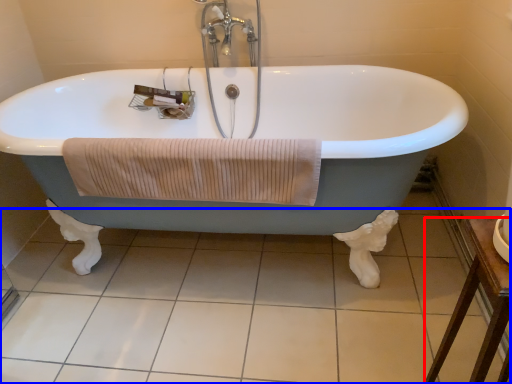
Question: Which object is closer to the camera taking this photo, furniture (highlighted by a red box) or tile (highlighted by a blue box)?

Choices:
 (A) furniture
 (B) tile

Answer: (A)